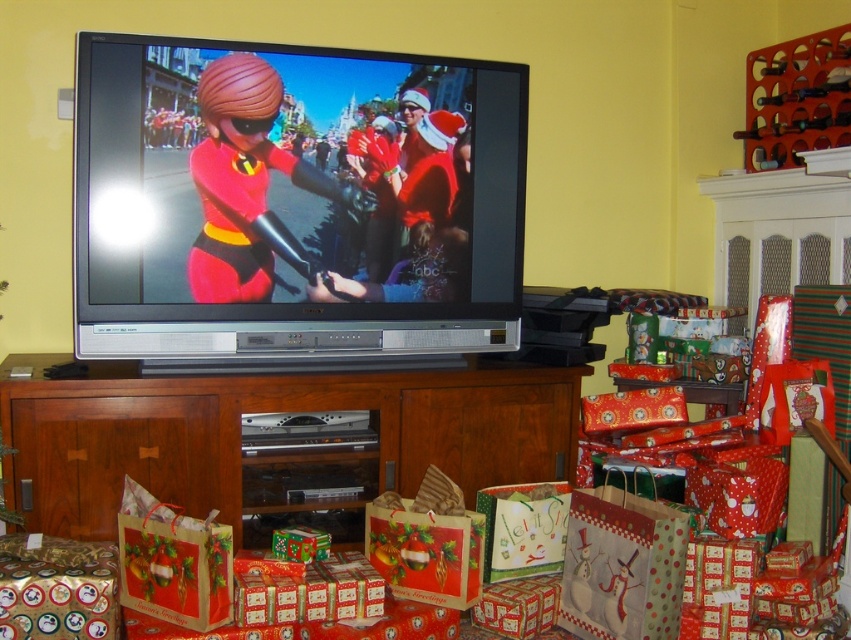
Question: Among these objects, which one is nearest to the camera?

Choices:
 (A) brown wood entertainment center at lower center
 (B) matte black television at upper center

Answer: (A)

Question: Can you confirm if matte black television at upper center is bigger than brown wood entertainment center at lower center?

Choices:
 (A) yes
 (B) no

Answer: (B)

Question: Is matte black television at upper center to the left of brown wood entertainment center at lower center from the viewer's perspective?

Choices:
 (A) yes
 (B) no

Answer: (B)

Question: Does matte black television at upper center appear under brown wood entertainment center at lower center?

Choices:
 (A) no
 (B) yes

Answer: (A)

Question: Which object appears farthest from the camera in this image?

Choices:
 (A) matte black television at upper center
 (B) brown wood entertainment center at lower center

Answer: (A)